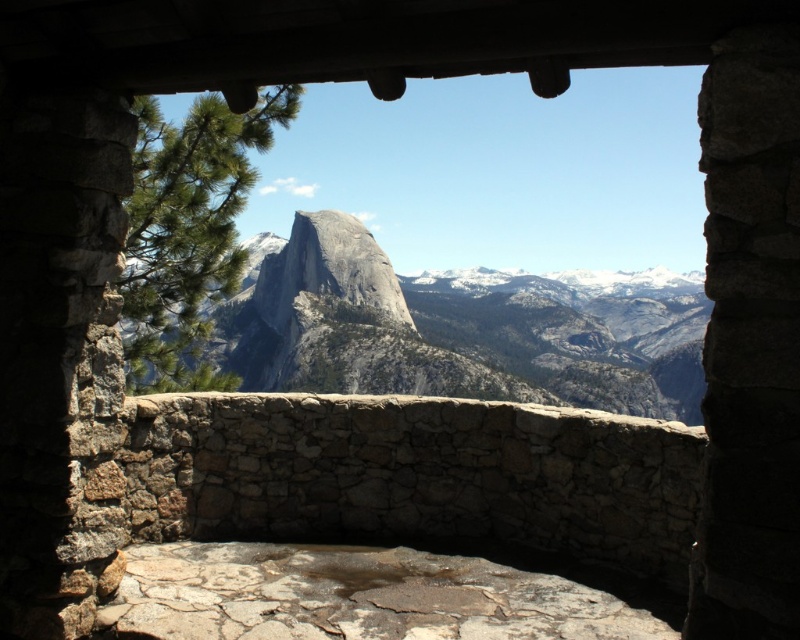
Measure the distance between gray/granite mountain at center and green textured pine at left.

They are 135.92 meters apart.

Who is shorter, gray/granite mountain at center or green textured pine at left?

green textured pine at left is shorter.

You are a GUI agent. You are given a task and a screenshot of the screen. Output one action in this format:
    pyautogui.click(x=<x>, y=<y>)
    Task: Click on the gray/granite mountain at center
    This screenshot has width=800, height=640.
    Given the screenshot: What is the action you would take?
    pyautogui.click(x=452, y=330)